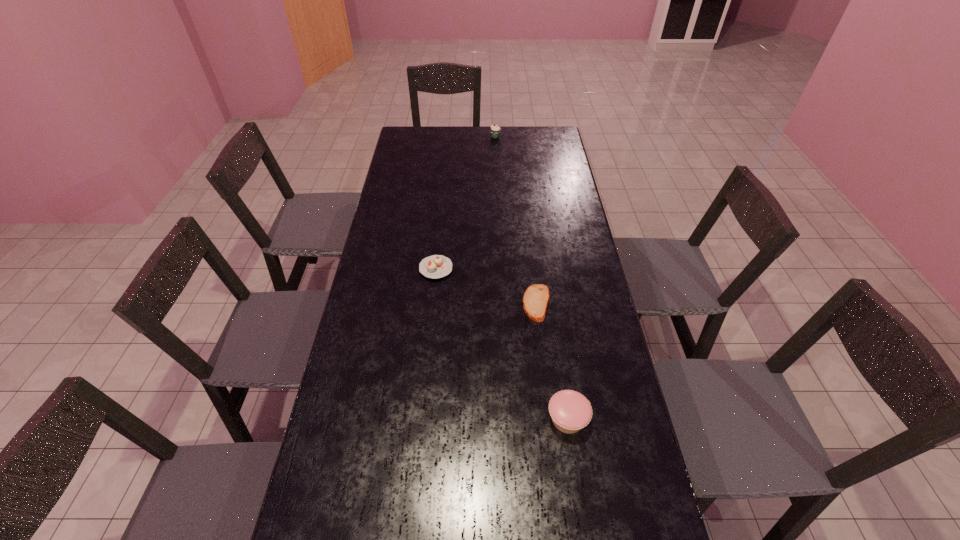
I want to click on empty location between the pita bread and the second shortest object, so [486, 286].

Identify the location of vacant region between the third tallest object and the tallest cupcake. (466, 202).

Locate an element on the screen. vacant area that lies between the shortest cupcake and the farthest cupcake is located at coordinates (466, 202).

Identify the location of free spot between the shortest cupcake and the pita bread. This screenshot has width=960, height=540. (486, 286).

Find the location of `vacant space that is in between the leftmost object and the farthest object`. vacant space that is in between the leftmost object and the farthest object is located at coordinates (466, 202).

Identify the location of free space between the third farthest object and the second tallest object. The width and height of the screenshot is (960, 540). (552, 361).

This screenshot has width=960, height=540. I want to click on empty space that is in between the pita bread and the nearest object, so click(552, 361).

This screenshot has width=960, height=540. I want to click on vacant point located between the second cupcake from left to right and the nearest object, so click(532, 278).

What are the coordinates of `unoccupied area between the second object from left to right and the second tallest cupcake` in the screenshot? It's located at (532, 278).

You are a GUI agent. You are given a task and a screenshot of the screen. Output one action in this format:
    pyautogui.click(x=<x>, y=<y>)
    Task: Click on the free point between the second tallest cupcake and the third object from right to left
    
    Given the screenshot: What is the action you would take?
    pyautogui.click(x=532, y=278)